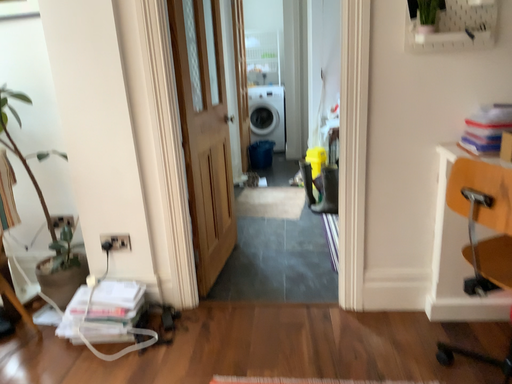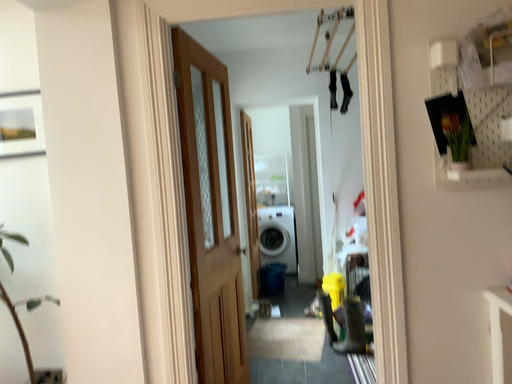
Question: Which way did the camera rotate in the video?

Choices:
 (A) rotated downward
 (B) rotated upward

Answer: (B)